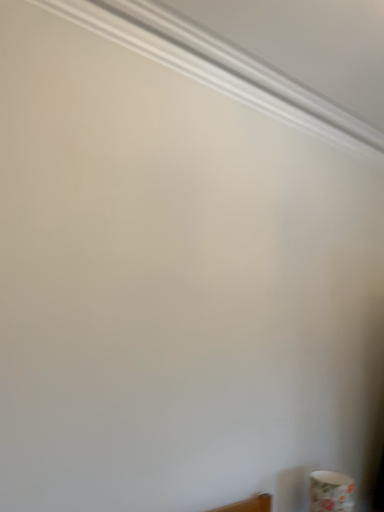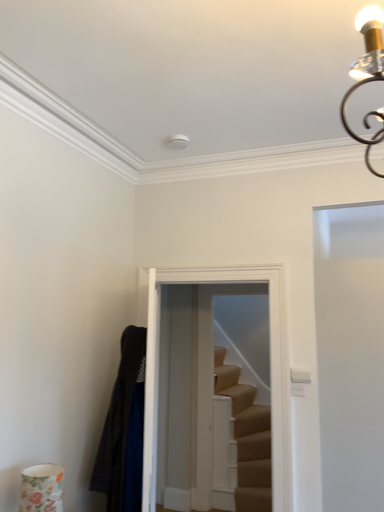
Question: Which way did the camera rotate in the video?

Choices:
 (A) rotated left
 (B) rotated right

Answer: (B)